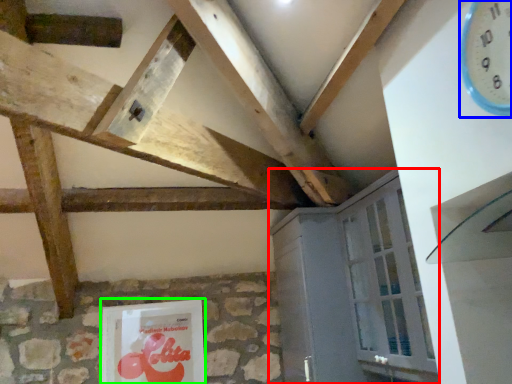
Question: Considering the real-world distances, which object is closest to cabinetry (highlighted by a red box)? clock (highlighted by a blue box) or picture frame (highlighted by a green box).

Choices:
 (A) clock
 (B) picture frame

Answer: (B)